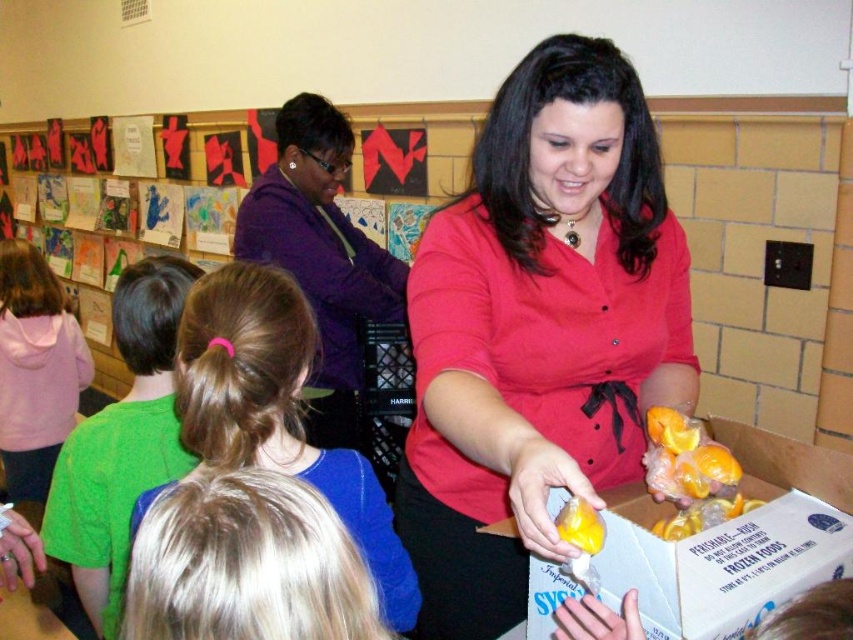
Does matte red blouse at center appear over blonde hair ponytail at center?

Correct, matte red blouse at center is located above blonde hair ponytail at center.

Does matte red blouse at center have a greater height compared to blonde hair ponytail at center?

Yes, matte red blouse at center is taller than blonde hair ponytail at center.

Is point (584, 148) farther from viewer compared to point (247, 410)?

Yes, it is.

This screenshot has height=640, width=853. I want to click on matte red blouse at center, so click(x=538, y=330).

Is point (402, 577) positioned behind point (570, 499)?

Yes, it is behind point (570, 499).

Between blonde hair ponytail at center and yellow rubber glove at lower center, which one appears on the left side from the viewer's perspective?

Positioned to the left is blonde hair ponytail at center.

Is point (300, 301) closer to viewer compared to point (602, 528)?

No, it is not.

I want to click on blonde hair ponytail at center, so (x=277, y=410).

Who is more forward, (534, 84) or (703, 449)?

Point (534, 84)

Which is more to the right, matte red blouse at center or yellow plastic oranges at center?

yellow plastic oranges at center

Who is more distant from viewer, (448, 588) or (670, 525)?

The point (448, 588) is behind.

At what (x,y) coordinates should I click in order to perform the action: click on matte red blouse at center. Please return your answer as a coordinate pair (x, y). The image size is (853, 640). Looking at the image, I should click on pos(538,330).